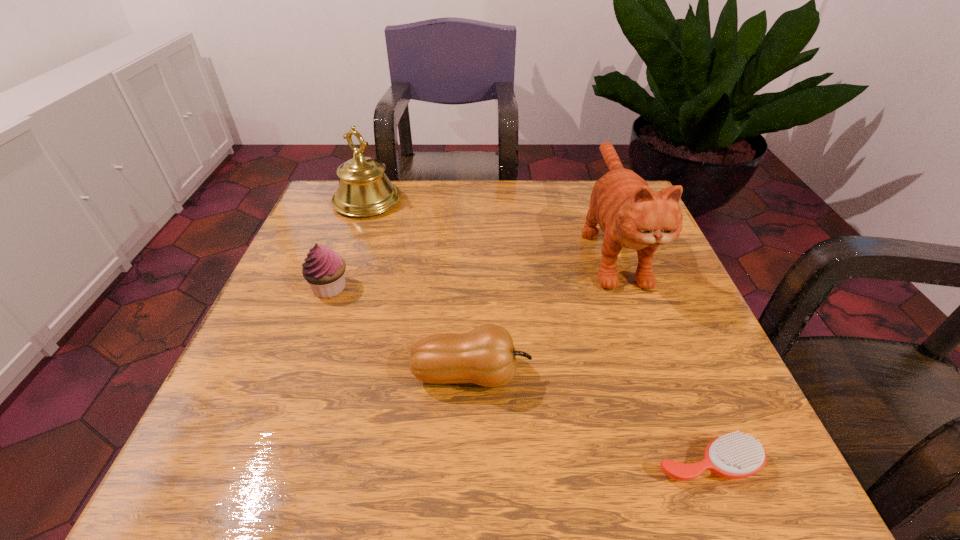
I want to click on unoccupied position between the fourth farthest object and the cupcake, so click(400, 331).

I want to click on vacant area that lies between the hairbrush and the fourth shortest object, so click(537, 332).

In order to click on free spot between the fourth shortest object and the cupcake in this screenshot , I will do `click(348, 244)`.

The width and height of the screenshot is (960, 540). I want to click on free area in between the tallest object and the second tallest object, so click(x=490, y=224).

Where is `empty location between the tallest object and the nearest object`? Image resolution: width=960 pixels, height=540 pixels. empty location between the tallest object and the nearest object is located at coordinates (660, 355).

At what (x,y) coordinates should I click in order to perform the action: click on empty location between the cat and the nearest object. Please return your answer as a coordinate pair (x, y). Looking at the image, I should click on pyautogui.click(x=660, y=355).

Where is `vacant area between the tallest object and the hairbrush`? This screenshot has width=960, height=540. vacant area between the tallest object and the hairbrush is located at coordinates (660, 355).

Where is `empty location between the fourth shortest object and the cat`? The image size is (960, 540). empty location between the fourth shortest object and the cat is located at coordinates (490, 224).

Image resolution: width=960 pixels, height=540 pixels. In order to click on vacant area between the cat and the gourd in this screenshot , I will do `click(541, 310)`.

What are the coordinates of `the third closest object to the cupcake` in the screenshot? It's located at (631, 215).